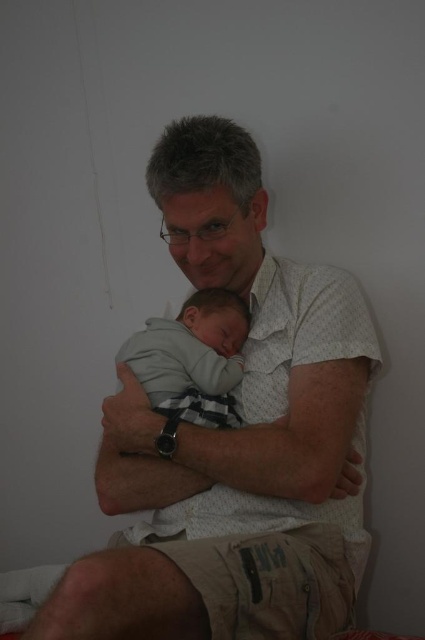
Question: Does white textured shirt at center appear under gray soft fabric baby at center?

Choices:
 (A) no
 (B) yes

Answer: (B)

Question: From the image, what is the correct spatial relationship of white textured shirt at center in relation to gray soft fabric baby at center?

Choices:
 (A) below
 (B) above

Answer: (A)

Question: Which of the following is the closest to the observer?

Choices:
 (A) gray soft fabric baby at center
 (B) white textured shirt at center

Answer: (B)

Question: Is white textured shirt at center in front of gray soft fabric baby at center?

Choices:
 (A) no
 (B) yes

Answer: (B)

Question: Which object is farther from the camera taking this photo?

Choices:
 (A) gray soft fabric baby at center
 (B) white textured shirt at center

Answer: (A)